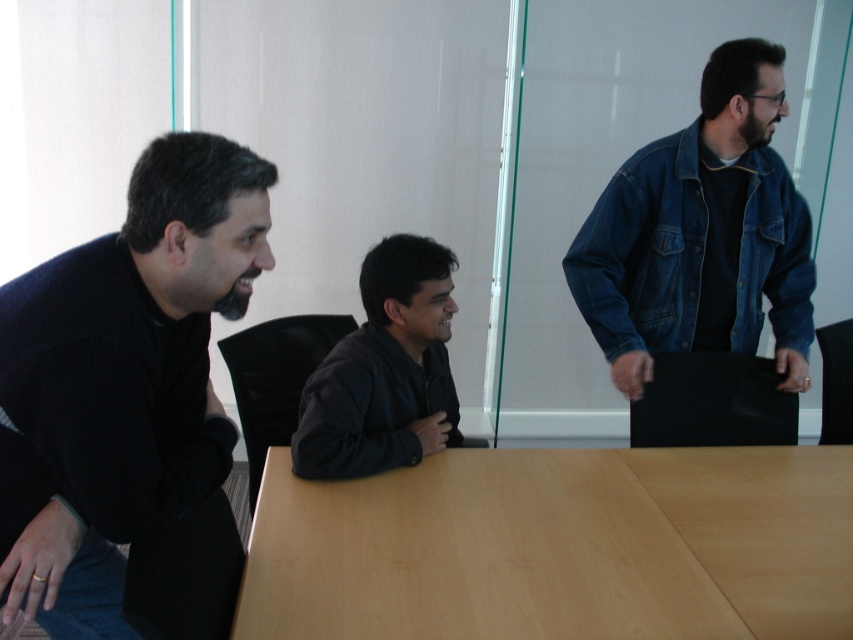
Is light brown wood table at center below dark blue sweater at left?

Yes, light brown wood table at center is below dark blue sweater at left.

Is light brown wood table at center to the left of dark blue sweater at left from the viewer's perspective?

No, light brown wood table at center is not to the left of dark blue sweater at left.

Who is more forward, [297,589] or [120,563]?

Positioned in front is point [297,589].

Find the location of `light brown wood table at center`. light brown wood table at center is located at coordinates (558, 547).

Which is behind, point (723, 566) or point (694, 134)?

Point (694, 134)

Image resolution: width=853 pixels, height=640 pixels. What do you see at coordinates (558, 547) in the screenshot? I see `light brown wood table at center` at bounding box center [558, 547].

What are the coordinates of `light brown wood table at center` in the screenshot? It's located at (558, 547).

Does dark blue sweater at left appear on the right side of black leather jacket at center?

Incorrect, dark blue sweater at left is not on the right side of black leather jacket at center.

Is point (62, 380) behind point (430, 292)?

No, it is in front of (430, 292).

The image size is (853, 640). In order to click on dark blue sweater at left in this screenshot , I will do `click(122, 380)`.

Locate an element on the screen. This screenshot has height=640, width=853. dark blue sweater at left is located at coordinates (122, 380).